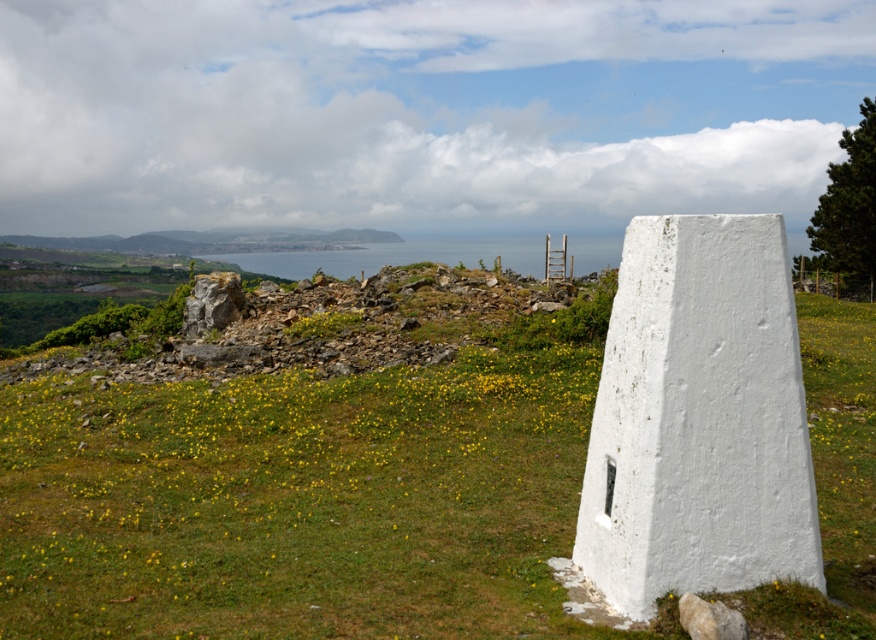
Question: Which of these objects is positioned farthest from the white painted stone obelisk at center?

Choices:
 (A) green grassy hillside at lower left
 (B) blue water at center
 (C) green grass at center

Answer: (A)

Question: Which of the following is the farthest from the observer?

Choices:
 (A) (691, 250)
 (B) (392, 244)
 (C) (555, 513)
 (D) (29, 243)

Answer: (D)

Question: Is green grass at center smaller than white painted stone obelisk at center?

Choices:
 (A) no
 (B) yes

Answer: (A)

Question: Estimate the real-world distances between objects in this image. Which object is farther from the white painted stone obelisk at center?

Choices:
 (A) green grass at center
 (B) green grassy hillside at lower left
 (C) blue water at center

Answer: (B)

Question: In this image, where is blue water at center located relative to green grassy hillside at lower left?

Choices:
 (A) right
 (B) left

Answer: (A)

Question: Does green grass at center have a greater width compared to white painted stone obelisk at center?

Choices:
 (A) no
 (B) yes

Answer: (B)